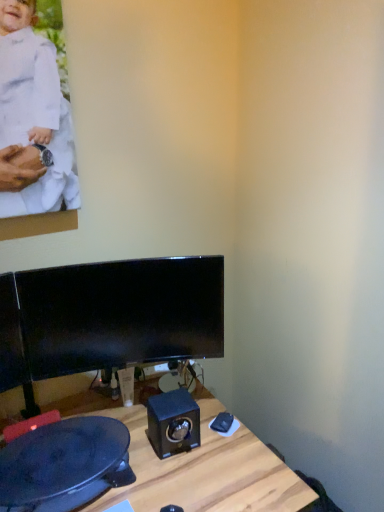
What is the approximate width of black glossy monitor at center?

black glossy monitor at center is 1.89 inches wide.

This screenshot has height=512, width=384. What are the coordinates of `black glossy monitor at center` in the screenshot? It's located at [121, 314].

Between black glossy speaker at center and black glossy monitor at center, which one appears on the right side from the viewer's perspective?

black glossy speaker at center.

Is black glossy speaker at center aimed at black glossy monitor at center?

No, black glossy speaker at center is not oriented towards black glossy monitor at center.

From the image's perspective, is black glossy speaker at center positioned above or below black glossy monitor at center?

From the image's perspective, black glossy speaker at center appears below black glossy monitor at center.

Is black glossy speaker at center inside the boundaries of black glossy monitor at center, or outside?

black glossy speaker at center is outside black glossy monitor at center.

This screenshot has height=512, width=384. I want to click on computer monitor located in front of the black glossy speaker at center, so click(x=121, y=314).

Is the surface of black glossy monitor at center in direct contact with black glossy speaker at center?

No, black glossy monitor at center is not with black glossy speaker at center.

Does point (24, 271) come closer to viewer compared to point (176, 399)?

No.

Is white matte clothing at upper left positioned far away from black glossy monitor at center?

white matte clothing at upper left is near black glossy monitor at center, not far away.

Identify the location of computer monitor located underneath the white matte clothing at upper left (from a real-world perspective). The height and width of the screenshot is (512, 384). (121, 314).

Which object is thinner, white matte clothing at upper left or black glossy monitor at center?

With smaller width is white matte clothing at upper left.

Considering the relative positions of white matte clothing at upper left and black glossy monitor at center in the image provided, is white matte clothing at upper left to the left or to the right of black glossy monitor at center?

Clearly, white matte clothing at upper left is on the left of black glossy monitor at center in the image.

What's the angular difference between wooden desk at center and white matte clothing at upper left's facing directions?

wooden desk at center and white matte clothing at upper left are facing 0.389 degrees away from each other.

Considering the sizes of objects wooden desk at center and white matte clothing at upper left in the image provided, who is shorter, wooden desk at center or white matte clothing at upper left?

Standing shorter between the two is white matte clothing at upper left.

In the image, is wooden desk at center on the left side or the right side of white matte clothing at upper left?

wooden desk at center is positioned on white matte clothing at upper left's right side.

Between wooden desk at center and white matte clothing at upper left, which one has larger size?

wooden desk at center.

From a real-world perspective, is white matte clothing at upper left on top of wooden desk at center?

Yes.

Is white matte clothing at upper left facing towards wooden desk at center?

No, white matte clothing at upper left is not oriented towards wooden desk at center.

Which object is further away from the camera taking this photo, white matte clothing at upper left or wooden desk at center?

white matte clothing at upper left.

Is white matte clothing at upper left completely or partially outside of wooden desk at center?

Yes, white matte clothing at upper left is located beyond the bounds of wooden desk at center.

Can you tell me how much black glossy monitor at center and white matte clothing at upper left differ in facing direction?

black glossy monitor at center and white matte clothing at upper left are facing 20.8 degrees away from each other.

Looking at their sizes, would you say black glossy monitor at center is wider or thinner than white matte clothing at upper left?

In the image, black glossy monitor at center appears to be wider than white matte clothing at upper left.

Is black glossy monitor at center facing towards white matte clothing at upper left?

No, black glossy monitor at center is not aimed at white matte clothing at upper left.

Based on the photo, is black glossy monitor at center directly adjacent to white matte clothing at upper left?

No, black glossy monitor at center is not making contact with white matte clothing at upper left.

Is point (150, 400) farther from viewer compared to point (9, 136)?

Yes, it is.

Does black glossy speaker at center appear on the left side of white matte clothing at upper left?

Incorrect, black glossy speaker at center is not on the left side of white matte clothing at upper left.

In the image, there is a black glossy speaker at center. Find the location of `person above it (from the image's perspective)`. person above it (from the image's perspective) is located at coordinates [34, 112].

The height and width of the screenshot is (512, 384). What are the coordinates of `speaker behind the black glossy monitor at center` in the screenshot? It's located at (173, 422).

Locate an element on the screen. speaker below the black glossy monitor at center (from the image's perspective) is located at coordinates (173, 422).

Considering their positions, is wooden desk at center positioned closer to white matte clothing at upper left than black glossy monitor at center?

The object closer to white matte clothing at upper left is black glossy monitor at center.

Based on their spatial positions, is black glossy speaker at center or wooden desk at center closer to white matte clothing at upper left?

black glossy speaker at center is closer to white matte clothing at upper left.

Which object lies further to the anchor point wooden desk at center, white matte clothing at upper left or black glossy monitor at center?

The object further to wooden desk at center is white matte clothing at upper left.

When comparing their distances from white matte clothing at upper left, does black glossy monitor at center or wooden desk at center seem further?

The object further to white matte clothing at upper left is wooden desk at center.

Which object lies nearer to the anchor point white matte clothing at upper left, wooden desk at center or black glossy speaker at center?

black glossy speaker at center.

Considering their positions, is wooden desk at center positioned closer to black glossy monitor at center than black glossy speaker at center?

Based on the image, black glossy speaker at center appears to be nearer to black glossy monitor at center.

Considering their positions, is wooden desk at center positioned further to black glossy speaker at center than black glossy monitor at center?

The object further to black glossy speaker at center is black glossy monitor at center.

Considering their positions, is black glossy monitor at center positioned closer to black glossy speaker at center than white matte clothing at upper left?

black glossy monitor at center is closer to black glossy speaker at center.

Identify the location of computer monitor between white matte clothing at upper left and black glossy speaker at center vertically. Image resolution: width=384 pixels, height=512 pixels. (121, 314).

This screenshot has width=384, height=512. In order to click on computer monitor between white matte clothing at upper left and wooden desk at center in the up-down direction in this screenshot , I will do `click(121, 314)`.

This screenshot has width=384, height=512. What are the coordinates of `speaker between black glossy monitor at center and wooden desk at center vertically` in the screenshot? It's located at (173, 422).

You are a GUI agent. You are given a task and a screenshot of the screen. Output one action in this format:
    pyautogui.click(x=<x>, y=<y>)
    Task: Click on the speaker between white matte clothing at upper left and wooden desk at center in the up-down direction
    The height and width of the screenshot is (512, 384).
    Given the screenshot: What is the action you would take?
    pyautogui.click(x=173, y=422)